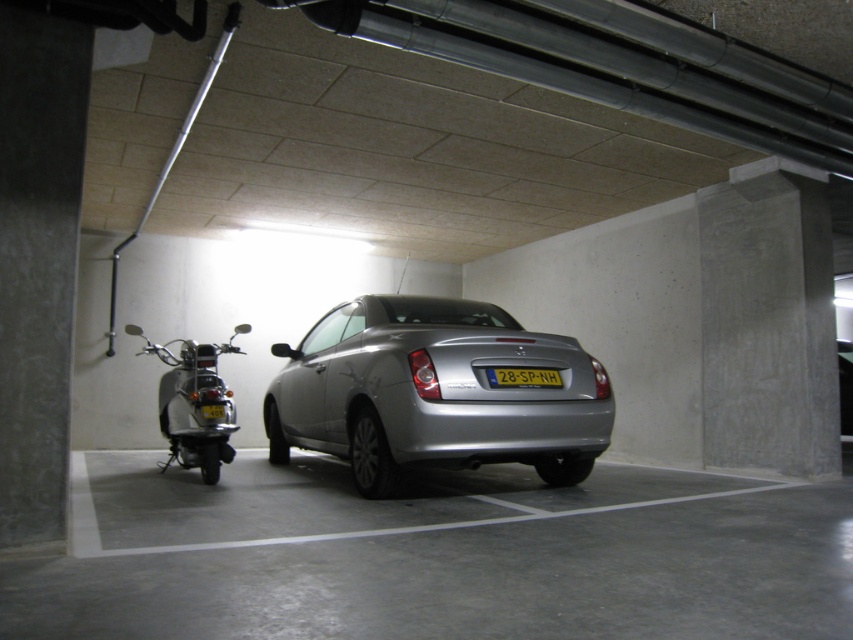
Question: Is silver metallic car at center in front of shiny chrome scooter at left?

Choices:
 (A) yes
 (B) no

Answer: (A)

Question: Does silver metallic car at center appear over yellow plastic license plate at center?

Choices:
 (A) yes
 (B) no

Answer: (B)

Question: Among these points, which one is nearest to the camera?

Choices:
 (A) (465, 406)
 (B) (531, 381)

Answer: (A)

Question: Among these points, which one is nearest to the camera?

Choices:
 (A) (242, 323)
 (B) (520, 387)
 (C) (368, 298)

Answer: (B)

Question: From the image, what is the correct spatial relationship of shiny chrome scooter at left in relation to yellow plastic license plate at center?

Choices:
 (A) below
 (B) above

Answer: (A)

Question: Which point appears closest to the camera in this image?

Choices:
 (A) (273, 410)
 (B) (202, 424)

Answer: (B)